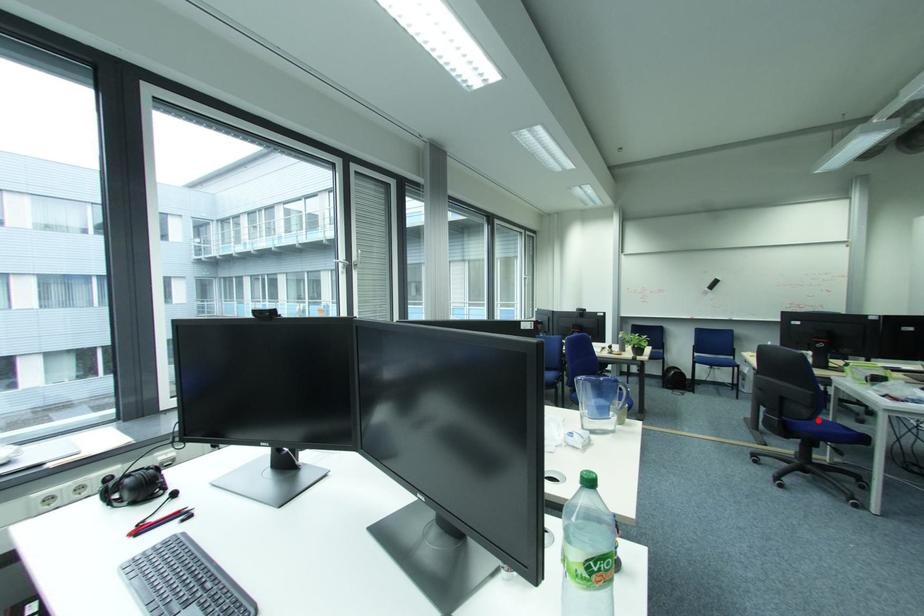
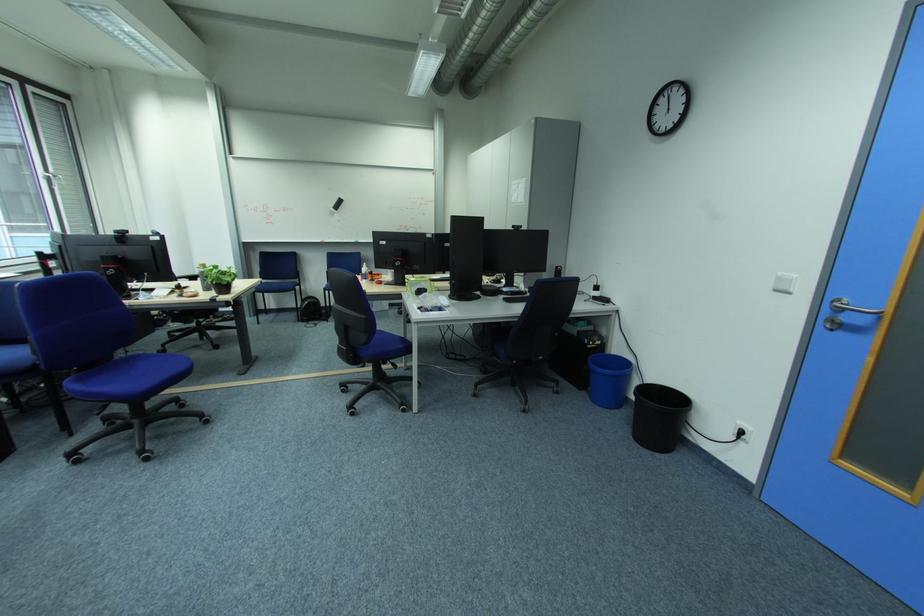
Where in the second image is the point corresponding to the highlighted location from the first image?

(375, 344)